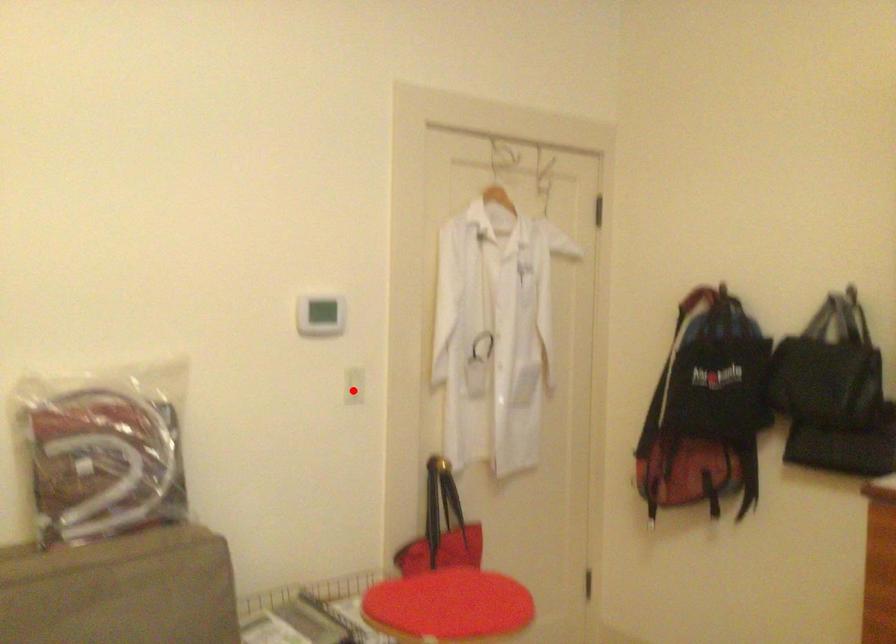
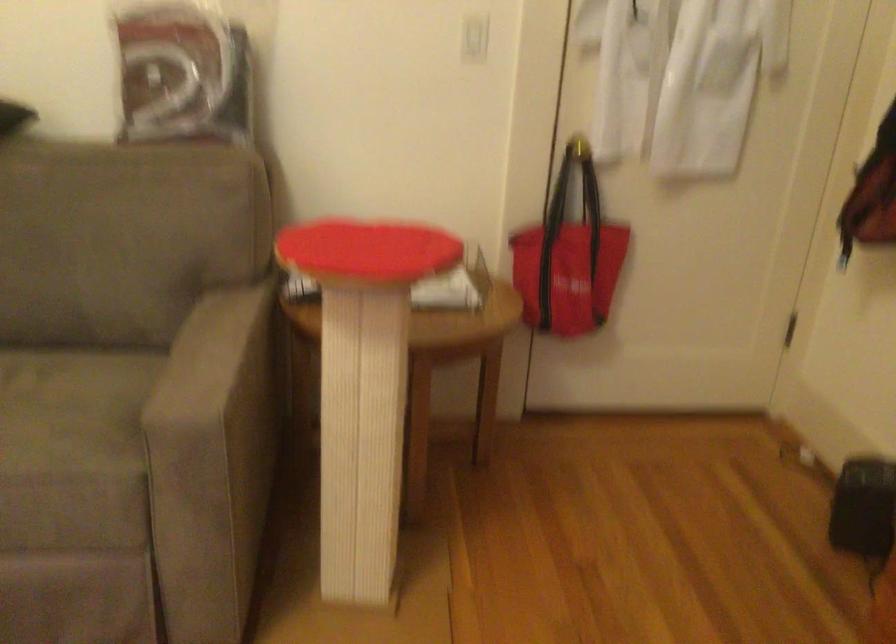
The point at the highlighted location is marked in the first image. Where is the corresponding point in the second image?

(474, 38)